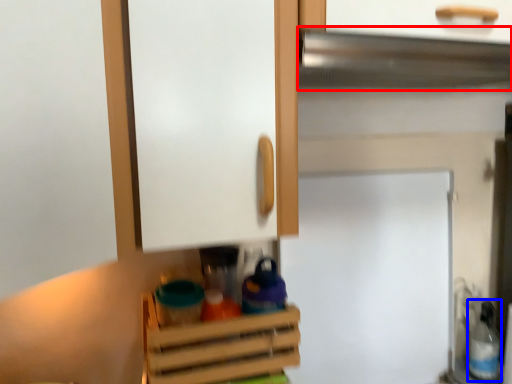
Question: Which point is further to the camera, exhaust hood (highlighted by a red box) or bottle (highlighted by a blue box)?

Choices:
 (A) exhaust hood
 (B) bottle

Answer: (B)